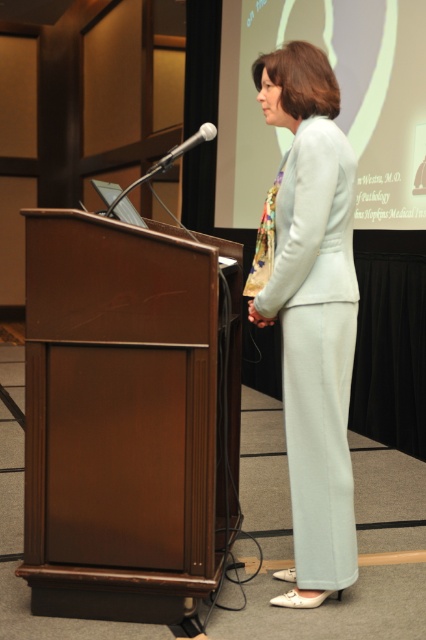
Question: Which point appears closest to the camera in this image?

Choices:
 (A) (319, 10)
 (B) (340, 193)
 (C) (83, 406)

Answer: (B)

Question: Is light blue fabric at center wider than white plastic microphone at center?

Choices:
 (A) no
 (B) yes

Answer: (B)

Question: Is brown polished wood podium at center to the right of light blue fabric suit at center from the viewer's perspective?

Choices:
 (A) yes
 (B) no

Answer: (B)

Question: Is the position of brown polished wood podium at center more distant than that of light blue fabric suit at center?

Choices:
 (A) yes
 (B) no

Answer: (B)

Question: Which of the following is the closest to the observer?

Choices:
 (A) (198, 452)
 (B) (189, 140)
 (C) (262, 152)
 (D) (273, 221)

Answer: (A)

Question: Which point is closer to the camera?

Choices:
 (A) (305, 540)
 (B) (239, 68)

Answer: (A)